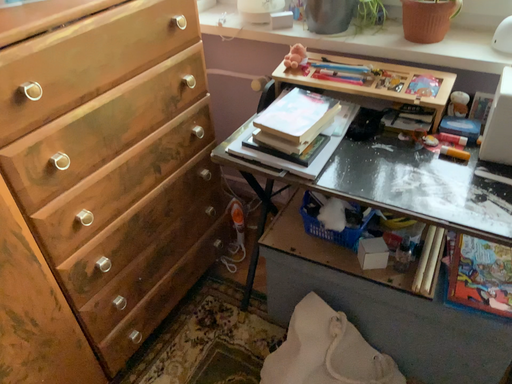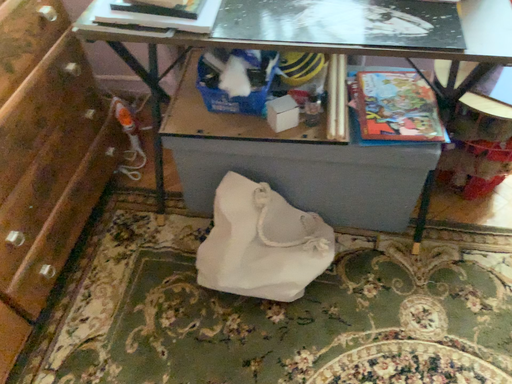
Question: How did the camera likely rotate when shooting the video?

Choices:
 (A) rotated left
 (B) rotated right

Answer: (B)